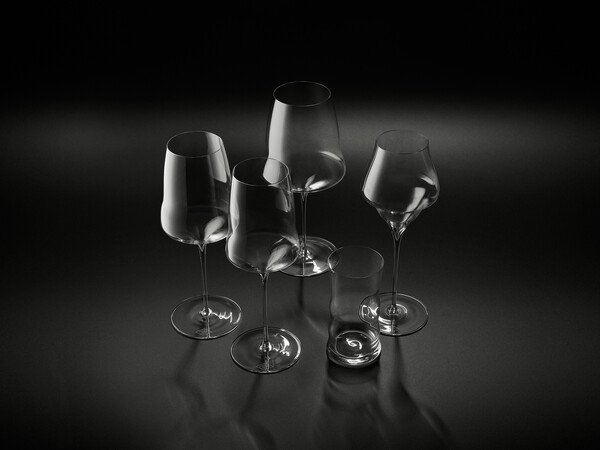
The image size is (600, 450). Find the location of `glassware`. glassware is located at coordinates (199, 177), (256, 199), (294, 129), (412, 170), (360, 305).